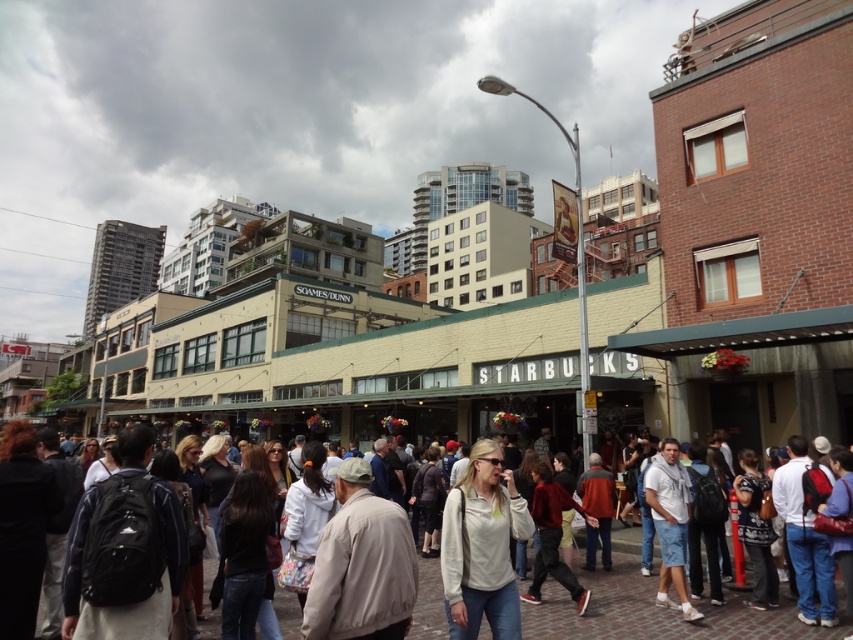
Which of these two, white cotton shirt at center or white matte jacket at center, stands taller?

white cotton shirt at center is taller.

In the scene shown: Is white cotton shirt at center above white matte jacket at center?

No, white cotton shirt at center is not above white matte jacket at center.

Does point (613, 598) come closer to viewer compared to point (485, 440)?

No, it is behind (485, 440).

Locate an element on the screen. white cotton shirt at center is located at coordinates (657, 612).